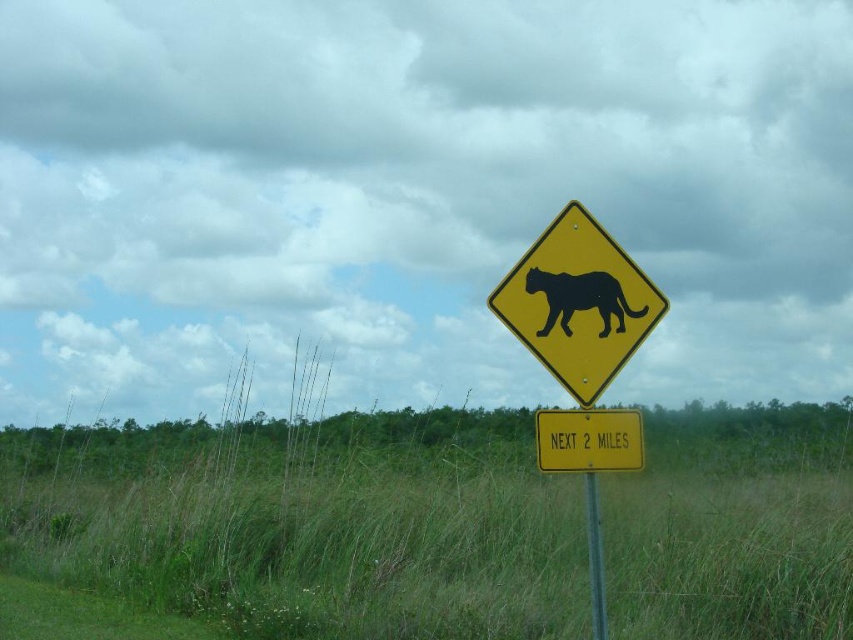
Question: Considering the real-world distances, which object is closest to the yellow/yellowish metal/texture sign at center?

Choices:
 (A) yellow plastic diamond-shaped sign with black silhouette of panther at center
 (B) black glossy panther at center
 (C) yellow metal pole at center

Answer: (C)

Question: Based on their relative distances, which object is nearer to the black glossy panther at center?

Choices:
 (A) yellow plastic diamond-shaped sign with black silhouette of panther at center
 (B) yellow metal pole at center

Answer: (A)

Question: Can you confirm if yellow/yellowish metal/texture sign at center is positioned to the left of black glossy panther at center?

Choices:
 (A) no
 (B) yes

Answer: (A)

Question: Is yellow plastic diamond-shaped sign with black silhouette of panther at center below yellow/yellowish metal/texture sign at center?

Choices:
 (A) no
 (B) yes

Answer: (A)

Question: Which point appears farthest from the camera in this image?

Choices:
 (A) (576, 292)
 (B) (556, 433)

Answer: (A)

Question: Does yellow plastic diamond-shaped sign with black silhouette of panther at center appear on the right side of yellow/yellowish metal/texture sign at center?

Choices:
 (A) no
 (B) yes

Answer: (A)